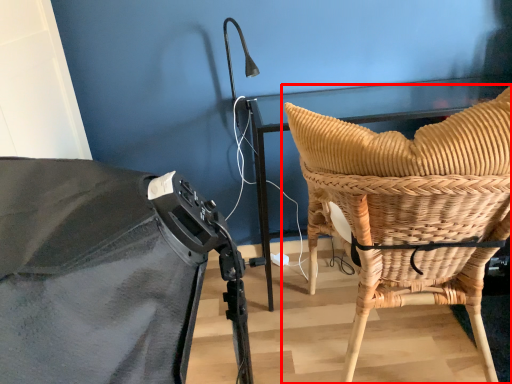
Question: In this image, where is chair (annotated by the red box) located relative to basket?

Choices:
 (A) left
 (B) right

Answer: (A)